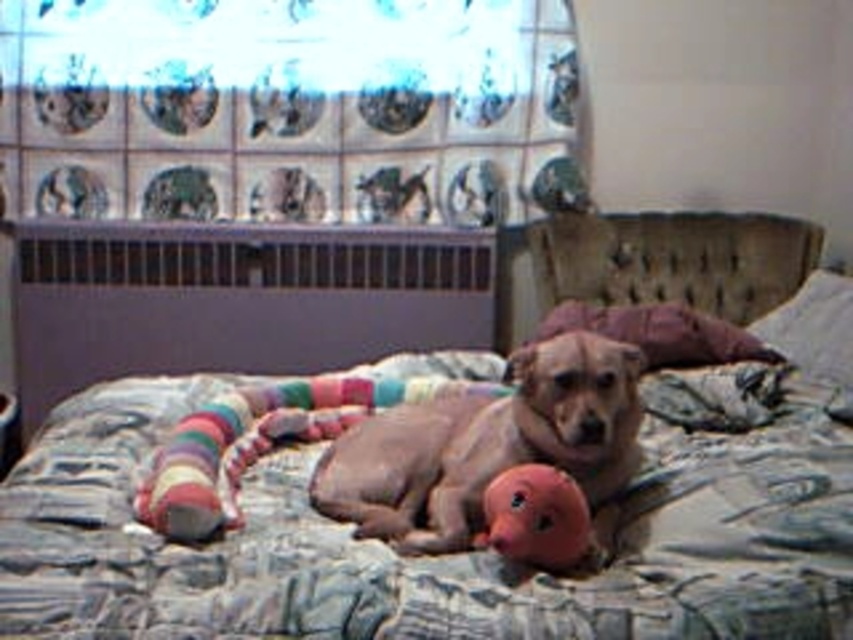
Between purple fabric pillow at center and pink rubber duck at center, which one appears on the right side from the viewer's perspective?

From the viewer's perspective, purple fabric pillow at center appears more on the right side.

Is purple fabric pillow at center in front of pink rubber duck at center?

That is False.

Is point (660, 365) less distant than point (566, 508)?

No.

Image resolution: width=853 pixels, height=640 pixels. Identify the location of purple fabric pillow at center. (659, 332).

Is point (107, 593) closer to viewer compared to point (758, 337)?

Yes.

At what (x,y) coordinates should I click in order to perform the action: click on textured fabric bed at center. Please return your answer as a coordinate pair (x, y). Looking at the image, I should click on (445, 556).

Is point (125, 483) positioned after point (618, 316)?

No.

Who is taller, textured fabric bed at center or purple fabric pillow at center?

textured fabric bed at center is taller.

Who is more forward, (347, 604) or (614, 314)?

Point (347, 604)

Identify the location of textured fabric bed at center. The image size is (853, 640). (445, 556).